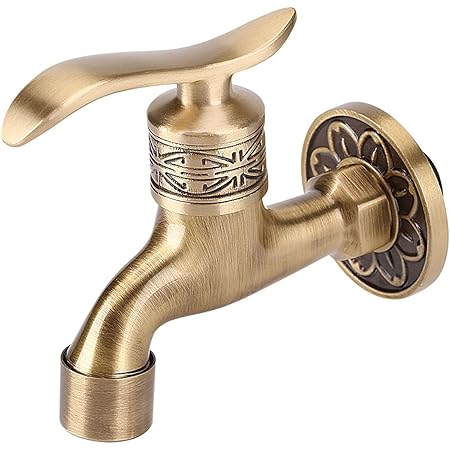
Point to visible where i would affix the facet to the wall where a water pipe is. in the image. Your answer should be formatted as a list of tuples, i.e. [(x1, y1), (x2, y2), ...], where each tuple contains the x and y coordinates of a point satisfying the conditions above.

[(406, 228)]